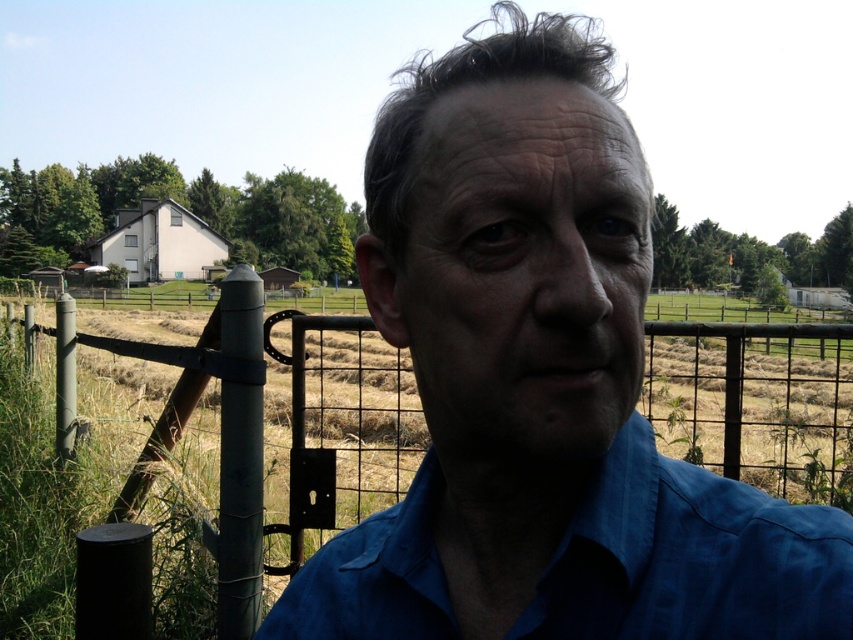
Question: Among these objects, which one is farthest from the camera?

Choices:
 (A) blue fabric shirt at center
 (B) metal wire fence at center

Answer: (B)

Question: Is blue fabric shirt at center further to the viewer compared to metal wire fence at center?

Choices:
 (A) yes
 (B) no

Answer: (B)

Question: Among these objects, which one is nearest to the camera?

Choices:
 (A) metal wire fence at center
 (B) blue fabric shirt at center

Answer: (B)

Question: Observing the image, what is the correct spatial positioning of blue fabric shirt at center in reference to metal wire fence at center?

Choices:
 (A) left
 (B) right

Answer: (B)

Question: Is blue fabric shirt at center positioned at the back of metal wire fence at center?

Choices:
 (A) no
 (B) yes

Answer: (A)